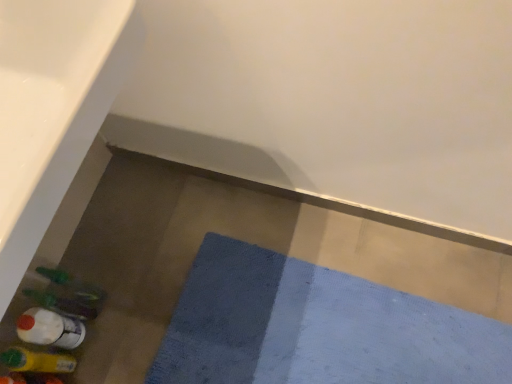
Question: Should I look upward or downward to see blue textured bath mat at lower center?

Choices:
 (A) up
 (B) down

Answer: (B)

Question: Are translucent plastic bottle at lower left, marked as the 1th bottle in a bottom-to-top arrangement, and white glossy bath at lower left far apart?

Choices:
 (A) no
 (B) yes

Answer: (A)

Question: Is translucent plastic bottle at lower left, marked as the 1th bottle in a bottom-to-top arrangement, positioned before white glossy bath at lower left?

Choices:
 (A) no
 (B) yes

Answer: (A)

Question: From a real-world perspective, is translucent plastic bottle at lower left, marked as the 1th bottle in a bottom-to-top arrangement, under white glossy bath at lower left?

Choices:
 (A) no
 (B) yes

Answer: (B)

Question: Can you confirm if translucent plastic bottle at lower left, which ranks as the 3th bottle in top-to-bottom order, is bigger than white glossy bath at lower left?

Choices:
 (A) yes
 (B) no

Answer: (B)

Question: Can you confirm if translucent plastic bottle at lower left, which ranks as the 3th bottle in top-to-bottom order, is smaller than white glossy bath at lower left?

Choices:
 (A) yes
 (B) no

Answer: (A)

Question: From the image's perspective, is translucent plastic bottle at lower left, which ranks as the 3th bottle in top-to-bottom order, on top of white glossy bath at lower left?

Choices:
 (A) no
 (B) yes

Answer: (A)

Question: Is translucent plastic bottle at lower left, which ranks as the 3th bottle in top-to-bottom order, to the right of translucent plastic bottle at lower left, the 3th bottle positioned from the bottom, from the viewer's perspective?

Choices:
 (A) yes
 (B) no

Answer: (B)

Question: From the image's perspective, is translucent plastic bottle at lower left, marked as the 1th bottle in a bottom-to-top arrangement, located beneath translucent plastic bottle at lower left, arranged as the first bottle when viewed from the top?

Choices:
 (A) no
 (B) yes

Answer: (B)

Question: From the image's perspective, is translucent plastic bottle at lower left, which ranks as the 3th bottle in top-to-bottom order, located above translucent plastic bottle at lower left, the 3th bottle positioned from the bottom?

Choices:
 (A) no
 (B) yes

Answer: (A)

Question: From a real-world perspective, is translucent plastic bottle at lower left, which ranks as the 3th bottle in top-to-bottom order, positioned over translucent plastic bottle at lower left, arranged as the first bottle when viewed from the top, based on gravity?

Choices:
 (A) no
 (B) yes

Answer: (B)

Question: Is translucent plastic bottle at lower left, which ranks as the 3th bottle in top-to-bottom order, at the left side of translucent plastic bottle at lower left, the 3th bottle positioned from the bottom?

Choices:
 (A) no
 (B) yes

Answer: (B)

Question: Would you say translucent plastic bottle at lower left, marked as the 1th bottle in a bottom-to-top arrangement, is outside translucent plastic bottle at lower left, the 3th bottle positioned from the bottom?

Choices:
 (A) yes
 (B) no

Answer: (A)

Question: Is translucent plastic bottle at lower left, the 3th bottle positioned from the bottom, not inside blue textured bath mat at lower center?

Choices:
 (A) yes
 (B) no

Answer: (A)